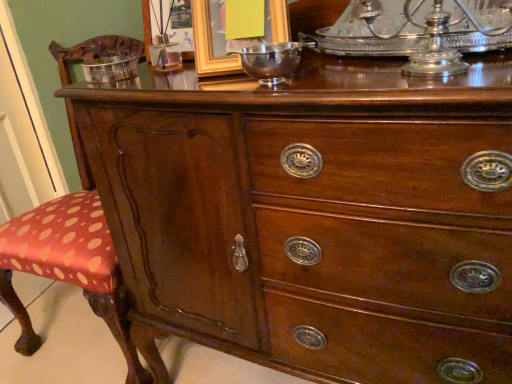
What do you see at coordinates (110, 69) in the screenshot?
I see `silver metallic bowl at upper left` at bounding box center [110, 69].

Describe the element at coordinates (209, 45) in the screenshot. This screenshot has width=512, height=384. I see `gold metallic picture frame at upper center, acting as the 2th picture frame starting from the left` at that location.

The width and height of the screenshot is (512, 384). I want to click on shiny silver bowl at center, so click(271, 60).

Are metallic gold picture frame at upper center, the second picture frame from the right, and shiny silver bowl at center making contact?

metallic gold picture frame at upper center, the second picture frame from the right, and shiny silver bowl at center are clearly separated.

This screenshot has width=512, height=384. In order to click on picture frame that is the 2nd object located above the shiny silver bowl at center (from the image's perspective) in this screenshot , I will do (150, 23).

From their relative heights in the image, would you say metallic gold picture frame at upper center, the second picture frame from the right, is taller or shorter than shiny silver bowl at center?

Considering their sizes, metallic gold picture frame at upper center, the second picture frame from the right, has more height than shiny silver bowl at center.

Considering the sizes of silver metallic bowl at upper left and metallic gold picture frame at upper center, the second picture frame from the right, in the image, is silver metallic bowl at upper left bigger or smaller than metallic gold picture frame at upper center, the second picture frame from the right,?

In the image, silver metallic bowl at upper left appears to be smaller than metallic gold picture frame at upper center, the second picture frame from the right.

From the image's perspective, which one is positioned higher, silver metallic bowl at upper left or metallic gold picture frame at upper center, which is the first picture frame in left-to-right order?

metallic gold picture frame at upper center, which is the first picture frame in left-to-right order, from the image's perspective.

Is silver metallic bowl at upper left thinner than metallic gold picture frame at upper center, the second picture frame from the right?

No, silver metallic bowl at upper left is not thinner than metallic gold picture frame at upper center, the second picture frame from the right.

Is silver metallic bowl at upper left behind metallic gold picture frame at upper center, the second picture frame from the right?

No, the depth of silver metallic bowl at upper left is less than that of metallic gold picture frame at upper center, the second picture frame from the right.

From a real-world perspective, between gold metallic picture frame at upper center, arranged as the 1th picture frame when viewed from the right, and shiny silver bowl at center, who is vertically higher?

gold metallic picture frame at upper center, arranged as the 1th picture frame when viewed from the right, is physically above.

Is gold metallic picture frame at upper center, arranged as the 1th picture frame when viewed from the right, far from shiny silver bowl at center?

gold metallic picture frame at upper center, arranged as the 1th picture frame when viewed from the right, is actually quite close to shiny silver bowl at center.

From the picture: What's the angular difference between gold metallic picture frame at upper center, arranged as the 1th picture frame when viewed from the right, and shiny silver bowl at center's facing directions?

The angular difference between gold metallic picture frame at upper center, arranged as the 1th picture frame when viewed from the right, and shiny silver bowl at center is 28.1 degrees.

From the picture: Can you confirm if gold metallic picture frame at upper center, acting as the 2th picture frame starting from the left, is positioned to the left of shiny silver bowl at center?

Indeed, gold metallic picture frame at upper center, acting as the 2th picture frame starting from the left, is positioned on the left side of shiny silver bowl at center.

Between metallic gold picture frame at upper center, the second picture frame from the right, and gold metallic picture frame at upper center, arranged as the 1th picture frame when viewed from the right, which one has more height?

With more height is gold metallic picture frame at upper center, arranged as the 1th picture frame when viewed from the right.

Does metallic gold picture frame at upper center, the second picture frame from the right, have a smaller size compared to gold metallic picture frame at upper center, acting as the 2th picture frame starting from the left?

Yes, metallic gold picture frame at upper center, the second picture frame from the right, is smaller than gold metallic picture frame at upper center, acting as the 2th picture frame starting from the left.

From the image's perspective, would you say metallic gold picture frame at upper center, the second picture frame from the right, is positioned over gold metallic picture frame at upper center, acting as the 2th picture frame starting from the left?

Yes, from the image's perspective, metallic gold picture frame at upper center, the second picture frame from the right, is over gold metallic picture frame at upper center, acting as the 2th picture frame starting from the left.

Is metallic gold picture frame at upper center, the second picture frame from the right, positioned with its back to gold metallic picture frame at upper center, acting as the 2th picture frame starting from the left?

No, metallic gold picture frame at upper center, the second picture frame from the right,'s orientation is not away from gold metallic picture frame at upper center, acting as the 2th picture frame starting from the left.

Is shiny silver bowl at center looking in the opposite direction of silver metallic bowl at upper left?

No.

Based on the photo, would you say shiny silver bowl at center is a long distance from silver metallic bowl at upper left?

shiny silver bowl at center is near silver metallic bowl at upper left, not far away.

Is shiny silver bowl at center taller than silver metallic bowl at upper left?

Correct, shiny silver bowl at center is much taller as silver metallic bowl at upper left.

From the picture: Considering the relative positions of metallic gold picture frame at upper center, which is the first picture frame in left-to-right order, and silver metallic bowl at upper left in the image provided, is metallic gold picture frame at upper center, which is the first picture frame in left-to-right order, to the left of silver metallic bowl at upper left from the viewer's perspective?

No.

Can we say metallic gold picture frame at upper center, the second picture frame from the right, lies outside silver metallic bowl at upper left?

That's correct, metallic gold picture frame at upper center, the second picture frame from the right, is outside of silver metallic bowl at upper left.

From the image's perspective, which is below, metallic gold picture frame at upper center, the second picture frame from the right, or silver metallic bowl at upper left?

silver metallic bowl at upper left appears lower in the image.

Consider the image. Does metallic gold picture frame at upper center, the second picture frame from the right, touch silver metallic bowl at upper left?

They are not placed beside each other.

From a real-world perspective, does gold metallic picture frame at upper center, arranged as the 1th picture frame when viewed from the right, sit lower than metallic gold picture frame at upper center, which is the first picture frame in left-to-right order?

Incorrect, from a real-world perspective, gold metallic picture frame at upper center, arranged as the 1th picture frame when viewed from the right, is higher than metallic gold picture frame at upper center, which is the first picture frame in left-to-right order.

Can you see gold metallic picture frame at upper center, acting as the 2th picture frame starting from the left, touching metallic gold picture frame at upper center, the second picture frame from the right?

They are not placed beside each other.

In the scene shown: Considering the relative sizes of gold metallic picture frame at upper center, acting as the 2th picture frame starting from the left, and metallic gold picture frame at upper center, the second picture frame from the right, in the image provided, is gold metallic picture frame at upper center, acting as the 2th picture frame starting from the left, smaller than metallic gold picture frame at upper center, the second picture frame from the right,?

No, gold metallic picture frame at upper center, acting as the 2th picture frame starting from the left, is not smaller than metallic gold picture frame at upper center, the second picture frame from the right.

Is gold metallic picture frame at upper center, arranged as the 1th picture frame when viewed from the right, not inside metallic gold picture frame at upper center, the second picture frame from the right?

Indeed, gold metallic picture frame at upper center, arranged as the 1th picture frame when viewed from the right, is completely outside metallic gold picture frame at upper center, the second picture frame from the right.

At what (x,y) coordinates should I click in order to perform the action: click on the 1st picture frame directly above the shiny silver bowl at center (from a real-world perspective). Please return your answer as a coordinate pair (x, y). Image resolution: width=512 pixels, height=384 pixels. Looking at the image, I should click on (150, 23).

Find the location of a particular element. Image resolution: width=512 pixels, height=384 pixels. bowl below the metallic gold picture frame at upper center, which is the first picture frame in left-to-right order (from the image's perspective) is located at coordinates (110, 69).

From the image, which object appears to be farther from shiny silver bowl at center, metallic gold picture frame at upper center, the second picture frame from the right, or silver metallic bowl at upper left?

Based on the image, silver metallic bowl at upper left appears to be further to shiny silver bowl at center.

When comparing their distances from gold metallic picture frame at upper center, acting as the 2th picture frame starting from the left, does silver metallic bowl at upper left or metallic gold picture frame at upper center, which is the first picture frame in left-to-right order, seem further?

The object further to gold metallic picture frame at upper center, acting as the 2th picture frame starting from the left, is silver metallic bowl at upper left.

Looking at the image, which one is located closer to gold metallic picture frame at upper center, arranged as the 1th picture frame when viewed from the right, metallic gold picture frame at upper center, the second picture frame from the right, or silver metallic bowl at upper left?

The object closer to gold metallic picture frame at upper center, arranged as the 1th picture frame when viewed from the right, is metallic gold picture frame at upper center, the second picture frame from the right.

In the scene shown: Which object lies further to the anchor point silver metallic bowl at upper left, shiny silver bowl at center or metallic gold picture frame at upper center, the second picture frame from the right?

shiny silver bowl at center.

Estimate the real-world distances between objects in this image. Which object is closer to metallic gold picture frame at upper center, which is the first picture frame in left-to-right order, gold metallic picture frame at upper center, acting as the 2th picture frame starting from the left, or silver metallic bowl at upper left?

Based on the image, silver metallic bowl at upper left appears to be nearer to metallic gold picture frame at upper center, which is the first picture frame in left-to-right order.

Looking at the image, which one is located closer to silver metallic bowl at upper left, metallic gold picture frame at upper center, which is the first picture frame in left-to-right order, or gold metallic picture frame at upper center, acting as the 2th picture frame starting from the left?

metallic gold picture frame at upper center, which is the first picture frame in left-to-right order, lies closer to silver metallic bowl at upper left than the other object.

Based on their spatial positions, is silver metallic bowl at upper left or shiny silver bowl at center further from metallic gold picture frame at upper center, the second picture frame from the right?

The object further to metallic gold picture frame at upper center, the second picture frame from the right, is shiny silver bowl at center.

Considering their positions, is gold metallic picture frame at upper center, acting as the 2th picture frame starting from the left, positioned further to silver metallic bowl at upper left than shiny silver bowl at center?

shiny silver bowl at center.

The height and width of the screenshot is (384, 512). Find the location of `picture frame located between silver metallic bowl at upper left and gold metallic picture frame at upper center, arranged as the 1th picture frame when viewed from the right, in the left-right direction`. picture frame located between silver metallic bowl at upper left and gold metallic picture frame at upper center, arranged as the 1th picture frame when viewed from the right, in the left-right direction is located at coordinates (150, 23).

Identify the location of picture frame situated between metallic gold picture frame at upper center, the second picture frame from the right, and shiny silver bowl at center from left to right. The height and width of the screenshot is (384, 512). (209, 45).